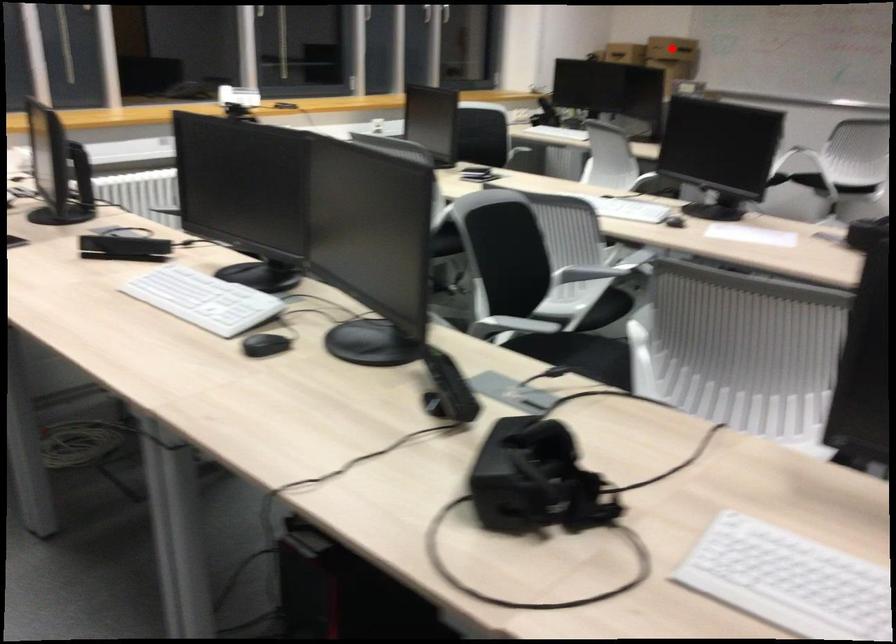
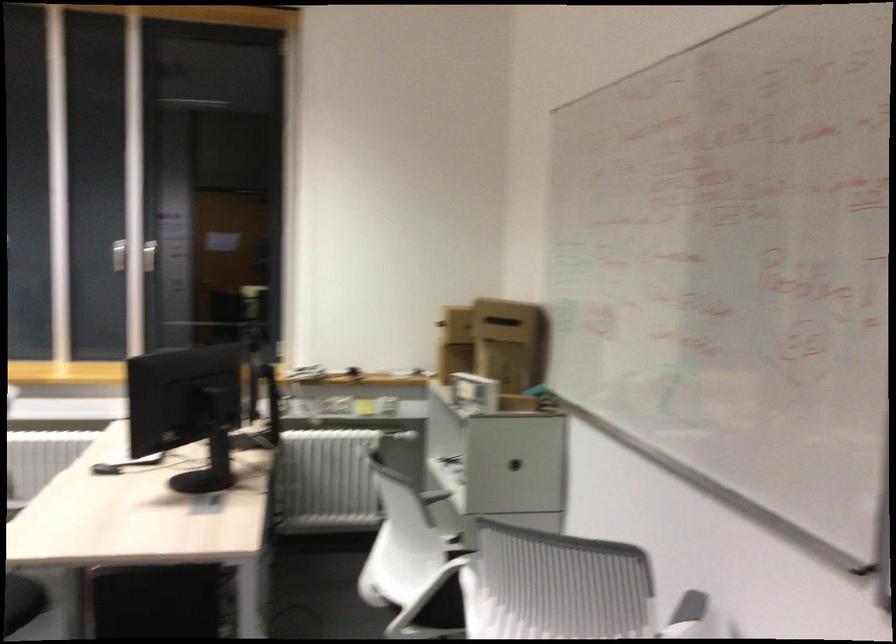
Question: I am providing you with two images of the same scene from different viewpoints. A red point is marked on the first image. Is the red point's position out of view in image 2?

Choices:
 (A) Yes
 (B) No

Answer: (A)